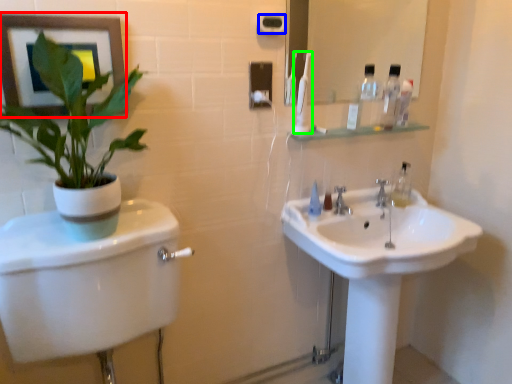
Question: Based on their relative distances, which object is farther from picture frame (highlighted by a red box)? Choose from towel bar (highlighted by a blue box) and toothbrush (highlighted by a green box).

Choices:
 (A) towel bar
 (B) toothbrush

Answer: (B)